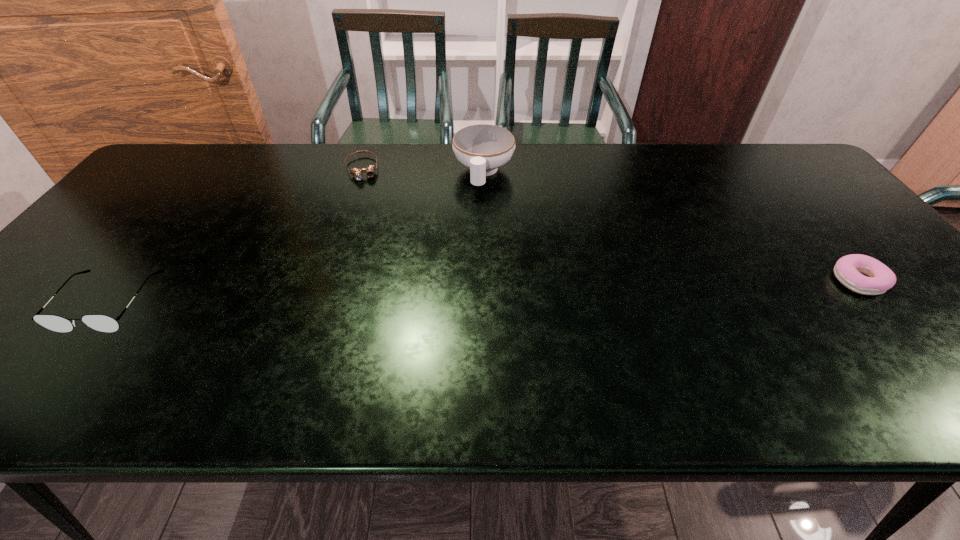
The width and height of the screenshot is (960, 540). In order to click on blank space located on the side with the handle of the tallest object in this screenshot , I will do `click(464, 255)`.

You are a GUI agent. You are given a task and a screenshot of the screen. Output one action in this format:
    pyautogui.click(x=<x>, y=<y>)
    Task: Click on the blank space located on the side with the handle of the tallest object
    This screenshot has height=540, width=960.
    Given the screenshot: What is the action you would take?
    pyautogui.click(x=473, y=218)

Identify the location of blank space located on the side with the handle of the tallest object. The image size is (960, 540). (471, 225).

Find the location of `blank area located 0.100m on the front lenses and sides of the shortest object`. blank area located 0.100m on the front lenses and sides of the shortest object is located at coordinates point(367,202).

I want to click on free space located 0.380m on the front lenses and sides of the shortest object, so click(382, 268).

In order to click on vacant region located 0.180m on the front lenses and sides of the shortest object in this screenshot , I will do `click(371, 219)`.

Image resolution: width=960 pixels, height=540 pixels. Find the location of `chinaware located at the far edge`. chinaware located at the far edge is located at coordinates (483, 148).

Locate an element on the screen. The image size is (960, 540). goggles that is at the far edge is located at coordinates (357, 173).

Where is `object located in the near edge section of the desktop`? This screenshot has width=960, height=540. object located in the near edge section of the desktop is located at coordinates (103, 323).

The width and height of the screenshot is (960, 540). What are the coordinates of `object located at the left edge` in the screenshot? It's located at (103, 323).